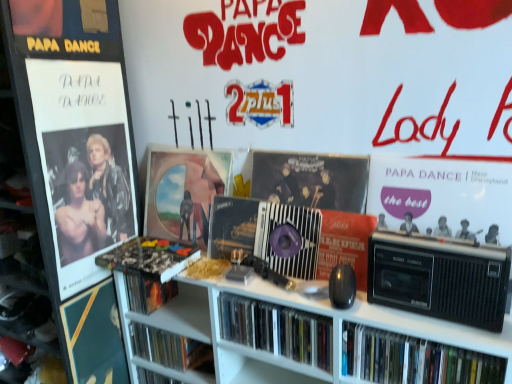
This screenshot has width=512, height=384. Find the location of `empty space that is ontop of camouflage-patterned book at center, arranged as the 2th book when viewed from the left`. empty space that is ontop of camouflage-patterned book at center, arranged as the 2th book when viewed from the left is located at coordinates (150, 249).